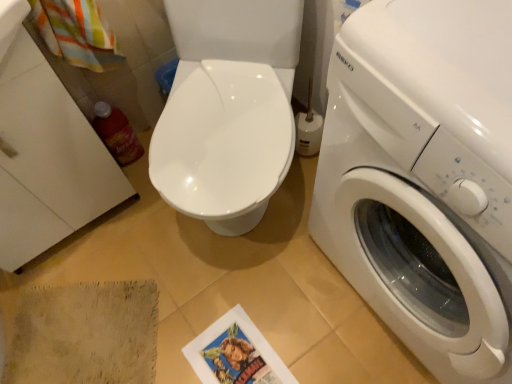
In order to face white glossy washing machine at right, should I rotate leftwards or rightwards?

It's best to rotate right around 28.497 degrees.

Where is `white glossy washing machine at right`? Image resolution: width=512 pixels, height=384 pixels. white glossy washing machine at right is located at coordinates (424, 178).

This screenshot has width=512, height=384. What do you see at coordinates (424, 178) in the screenshot?
I see `white glossy washing machine at right` at bounding box center [424, 178].

What is the approximate width of white glossy washing machine at right?

The width of white glossy washing machine at right is 19.92 inches.

Find the location of `white glossy washing machine at right`. white glossy washing machine at right is located at coordinates (424, 178).